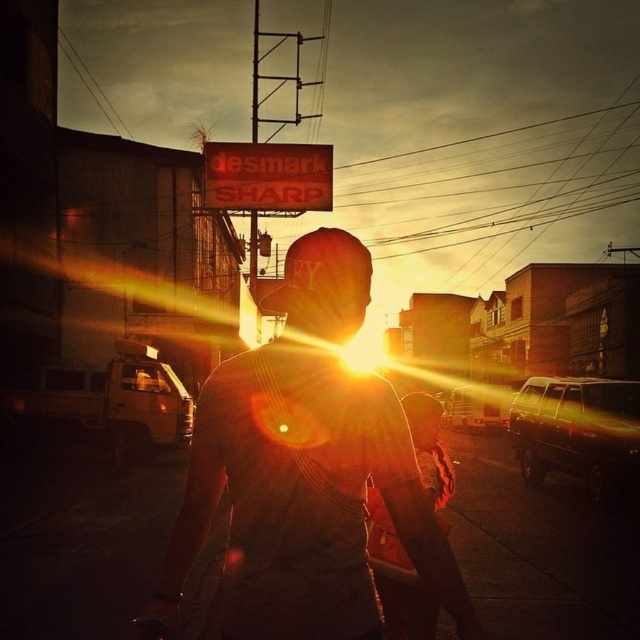
Is point (365, 378) closer to viewer compared to point (317, 189)?

Yes, it is.

Does dark gray t-shirt at center have a greater width compared to red plastic sign at upper center?

No, dark gray t-shirt at center is not wider than red plastic sign at upper center.

What do you see at coordinates (307, 470) in the screenshot? The image size is (640, 640). I see `dark gray t-shirt at center` at bounding box center [307, 470].

This screenshot has width=640, height=640. I want to click on dark gray t-shirt at center, so click(307, 470).